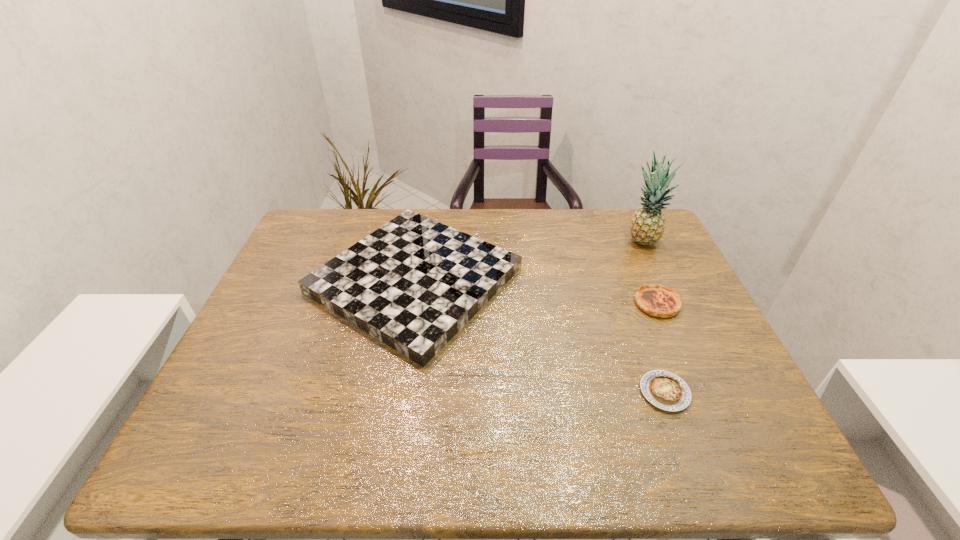
Identify the location of vacant point located on the back of the nearest object. The height and width of the screenshot is (540, 960). (648, 348).

The image size is (960, 540). I want to click on pineapple that is at the far edge, so click(x=647, y=226).

Find the location of a particular element. This screenshot has height=540, width=960. checkerboard present at the far edge is located at coordinates (414, 283).

I want to click on object situated at the left edge, so click(x=414, y=283).

Identify the location of pineapple that is at the right edge. 647,226.

The height and width of the screenshot is (540, 960). What are the coordinates of `object that is at the far left corner` in the screenshot? It's located at (414, 283).

Locate an element on the screen. object located in the far right corner section of the desktop is located at coordinates (647, 226).

You are a GUI agent. You are given a task and a screenshot of the screen. Output one action in this format:
    pyautogui.click(x=<x>, y=<y>)
    Task: Click on the free spot at the far edge of the desktop
    
    Given the screenshot: What is the action you would take?
    pyautogui.click(x=460, y=230)

Find the location of `vacant space at the near edge of the desktop`. vacant space at the near edge of the desktop is located at coordinates (570, 435).

Where is `free region at the left edge`? The height and width of the screenshot is (540, 960). free region at the left edge is located at coordinates (250, 418).